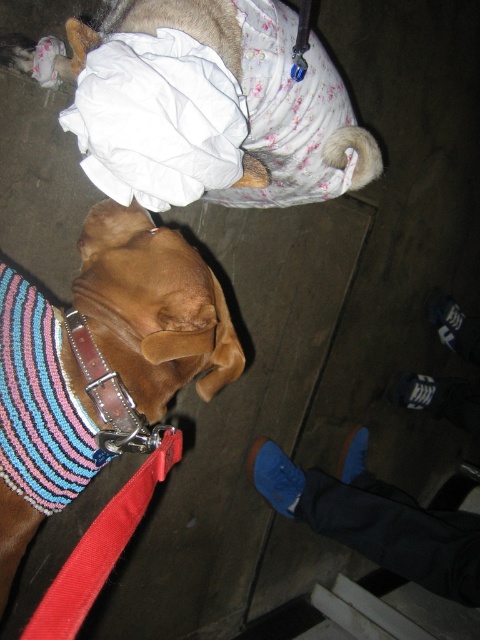
In the scene shown: Is fluffy white fur at upper center bigger than brown leather dog at lower left?

Indeed, fluffy white fur at upper center has a larger size compared to brown leather dog at lower left.

Between fluffy white fur at upper center and brown leather dog at lower left, which one appears on the right side from the viewer's perspective?

Positioned to the right is fluffy white fur at upper center.

Is point (227, 192) less distant than point (112, 337)?

No, it is behind (112, 337).

I want to click on fluffy white fur at upper center, so click(x=208, y=106).

Which is in front, point (232, 340) or point (105, 579)?

Point (105, 579) is more forward.

Identify the location of brown leather dog at lower left. (153, 307).

Is point (214, 305) positioned in front of point (54, 637)?

No.

Find the location of a particular element. The image size is (480, 640). brown leather dog at lower left is located at coordinates (153, 307).

Identify the location of red fabric leash at lower left. Image resolution: width=480 pixels, height=640 pixels. (100, 547).

Who is taller, red fabric leash at lower left or leather at left?

With more height is leather at left.

Is point (38, 605) behind point (93, 369)?

Yes, it is behind point (93, 369).

Identify the location of red fabric leash at lower left. Image resolution: width=480 pixels, height=640 pixels. (100, 547).